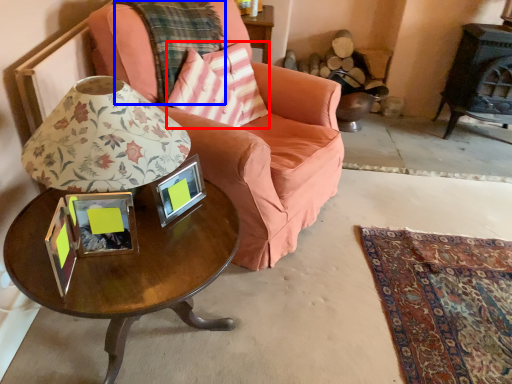
Question: Which object appears farthest to the camera in this image, throw pillow (highlighted by a red box) or plaid (highlighted by a blue box)?

Choices:
 (A) throw pillow
 (B) plaid

Answer: (A)